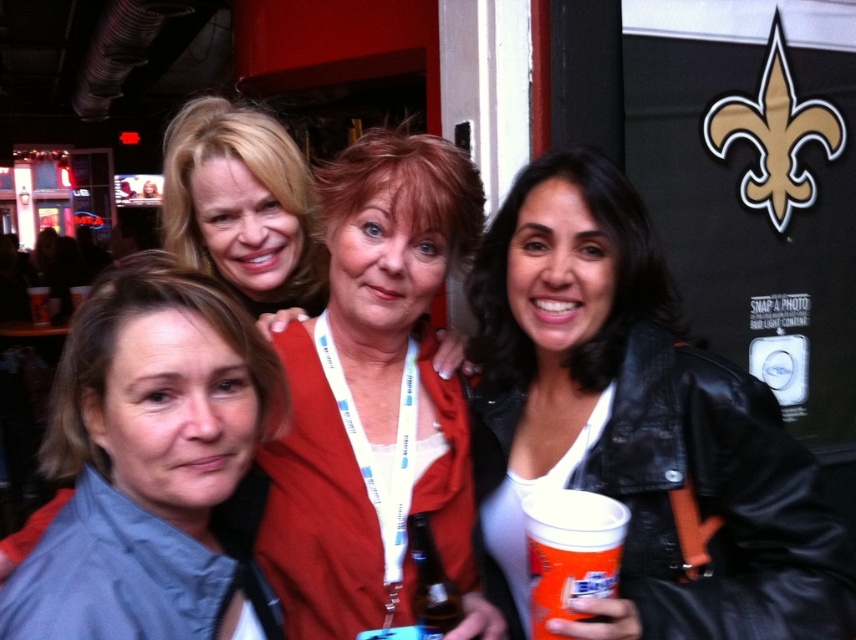
You are at a party and need to find the black leather jacket at center and the gray fabric jacket at lower left. Which one is located to the right of the other?

The black leather jacket at center is positioned on the right side of gray fabric jacket at lower left.

You are a photographer at the event and want to adjust the camera focus. The matte black jacket at center and the matte blonde hair at upper left are in the frame. Which object is closer to the camera?

The matte black jacket at center is closer to the camera since it is only 17.96 inches away from the matte blonde hair at upper left.

Based on the photo, you are a photographer at the event and want to ensure all subjects are in focus. Since the black leather jacket at center and matte blonde hair at upper left are important, which one might require more attention to avoid blurring due to its size?

The black leather jacket at center has a larger size compared to matte blonde hair at upper left, so it might require more attention to avoid blurring since it occupies more space in the frame.